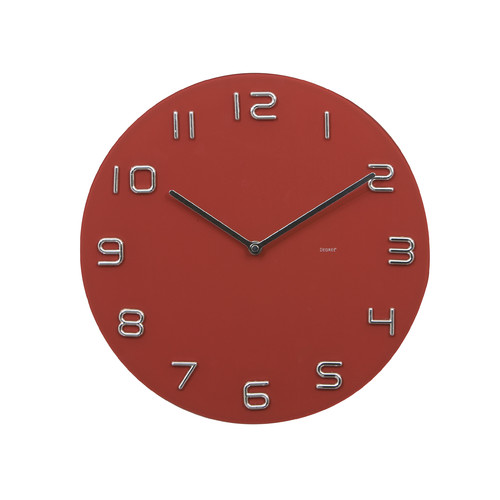
What are the coordinates of `red clock` in the screenshot? It's located at (177, 308).